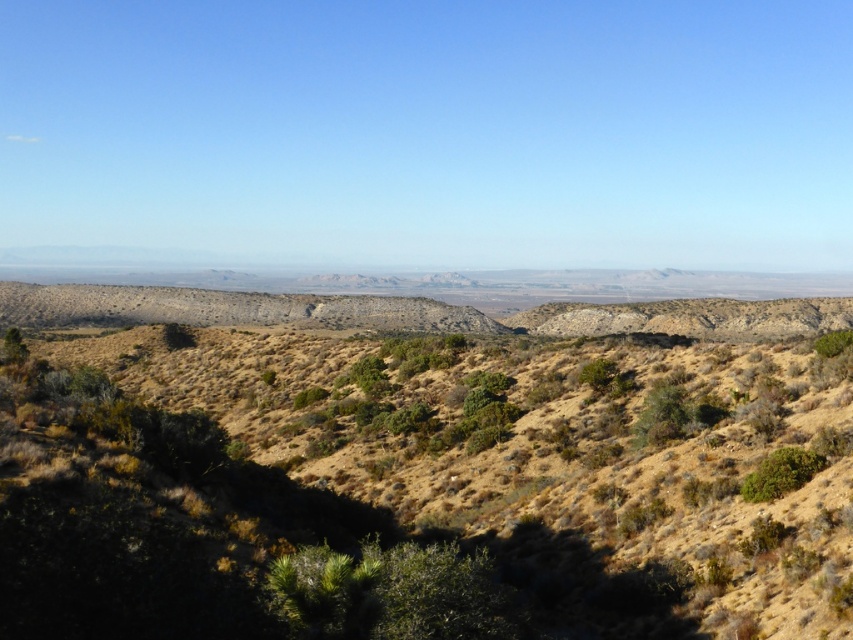
Question: Is dry grassland at center further to the viewer compared to green leafy bush at lower right?

Choices:
 (A) no
 (B) yes

Answer: (A)

Question: Can you confirm if dry grassland at center is positioned to the right of green leafy bush at lower right?

Choices:
 (A) no
 (B) yes

Answer: (A)

Question: Which point is farther to the camera?

Choices:
 (A) green leafy bush at lower right
 (B) dry grassland at center

Answer: (A)

Question: Is dry grassland at center to the left of green leafy bush at lower right from the viewer's perspective?

Choices:
 (A) no
 (B) yes

Answer: (B)